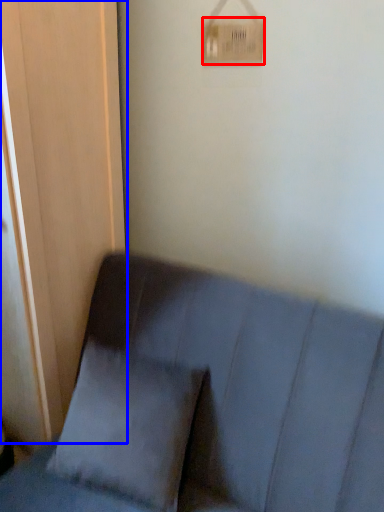
Question: Which point is closer to the camera, light switch (highlighted by a red box) or screen door (highlighted by a blue box)?

Choices:
 (A) light switch
 (B) screen door

Answer: (B)